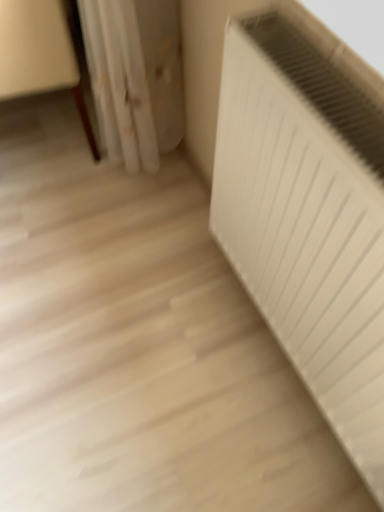
Question: Is the position of white matte radiator at right less distant than that of wooden floor at lower left?

Choices:
 (A) yes
 (B) no

Answer: (A)

Question: From a real-world perspective, is white matte radiator at right beneath wooden floor at lower left?

Choices:
 (A) yes
 (B) no

Answer: (B)

Question: Is white matte radiator at right turned away from wooden floor at lower left?

Choices:
 (A) no
 (B) yes

Answer: (A)

Question: Is white matte radiator at right aimed at wooden floor at lower left?

Choices:
 (A) no
 (B) yes

Answer: (A)

Question: From a real-world perspective, is white matte radiator at right on wooden floor at lower left?

Choices:
 (A) no
 (B) yes

Answer: (B)

Question: Does white matte radiator at right have a greater width compared to wooden floor at lower left?

Choices:
 (A) no
 (B) yes

Answer: (A)

Question: Can you confirm if wooden floor at lower left is smaller than white matte radiator at right?

Choices:
 (A) yes
 (B) no

Answer: (B)

Question: Can you confirm if wooden floor at lower left is shorter than white matte radiator at right?

Choices:
 (A) no
 (B) yes

Answer: (A)

Question: Is wooden floor at lower left facing towards white matte radiator at right?

Choices:
 (A) no
 (B) yes

Answer: (A)

Question: Is wooden floor at lower left not inside white matte radiator at right?

Choices:
 (A) yes
 (B) no

Answer: (A)

Question: From the image's perspective, does wooden floor at lower left appear higher than white matte radiator at right?

Choices:
 (A) yes
 (B) no

Answer: (A)

Question: Is wooden floor at lower left further to the viewer compared to white matte radiator at right?

Choices:
 (A) yes
 (B) no

Answer: (A)

Question: Is wooden floor at lower left wider or thinner than white matte radiator at right?

Choices:
 (A) wide
 (B) thin

Answer: (A)